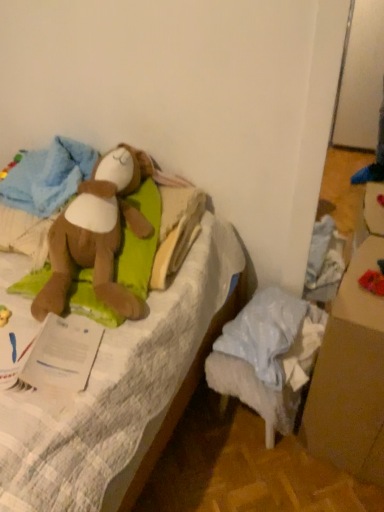
Question: Is red fabric toy at lower right, the first toy in the right-to-left sequence, not near white paper at left?

Choices:
 (A) no
 (B) yes

Answer: (A)

Question: Is red fabric toy at lower right, arranged as the second toy when viewed from the left, completely or partially outside of white paper at left?

Choices:
 (A) yes
 (B) no

Answer: (A)

Question: Can you confirm if red fabric toy at lower right, the first toy in the right-to-left sequence, is thinner than white paper at left?

Choices:
 (A) no
 (B) yes

Answer: (B)

Question: Does red fabric toy at lower right, arranged as the second toy when viewed from the left, have a smaller size compared to white paper at left?

Choices:
 (A) no
 (B) yes

Answer: (B)

Question: From a real-world perspective, is red fabric toy at lower right, arranged as the second toy when viewed from the left, over white paper at left?

Choices:
 (A) yes
 (B) no

Answer: (A)

Question: Is white paper at left completely or partially inside red fabric toy at lower right, arranged as the second toy when viewed from the left?

Choices:
 (A) no
 (B) yes

Answer: (A)

Question: From the image's perspective, does white paper at left appear lower than brown plush toy at upper left?

Choices:
 (A) no
 (B) yes

Answer: (B)

Question: Considering the relative sizes of white paper at left and brown plush toy at upper left in the image provided, is white paper at left bigger than brown plush toy at upper left?

Choices:
 (A) yes
 (B) no

Answer: (B)

Question: Considering the relative sizes of white paper at left and brown plush toy at upper left in the image provided, is white paper at left taller than brown plush toy at upper left?

Choices:
 (A) no
 (B) yes

Answer: (A)

Question: Can you confirm if white paper at left is shorter than brown plush toy at upper left?

Choices:
 (A) yes
 (B) no

Answer: (A)

Question: From the image's perspective, is white paper at left above brown plush toy at upper left?

Choices:
 (A) no
 (B) yes

Answer: (A)

Question: Does white paper at left appear on the right side of brown plush toy at upper left?

Choices:
 (A) no
 (B) yes

Answer: (B)

Question: Can we say white paper at left lies outside brown cardboard box at lower right?

Choices:
 (A) no
 (B) yes

Answer: (B)